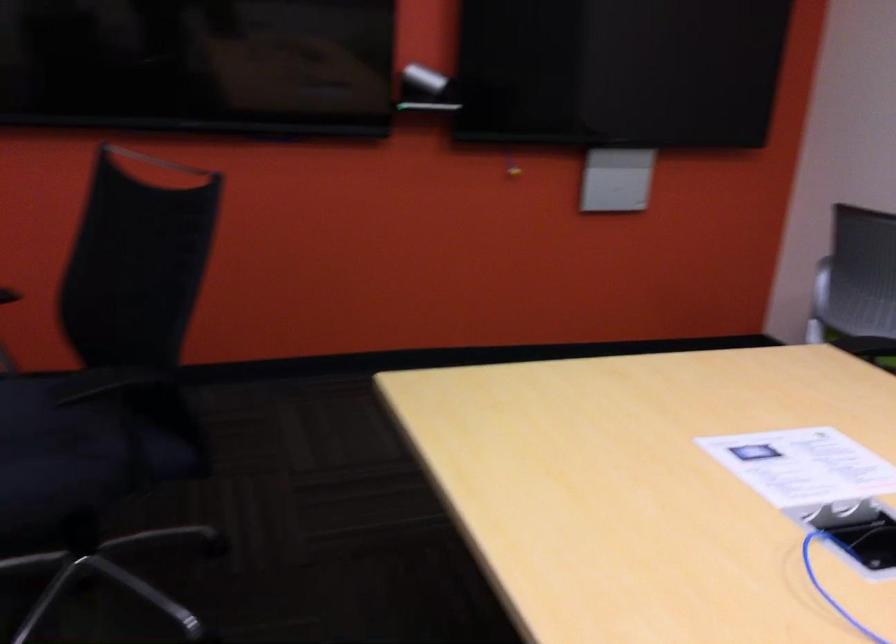
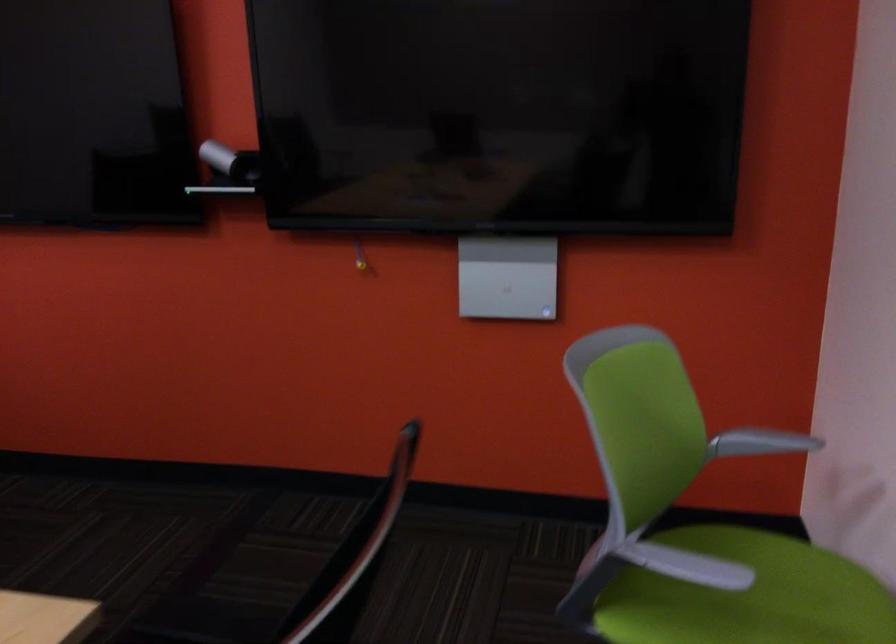
In a continuous first-person perspective shot, in which direction is the camera moving?

The cameraman moved toward right, forward.